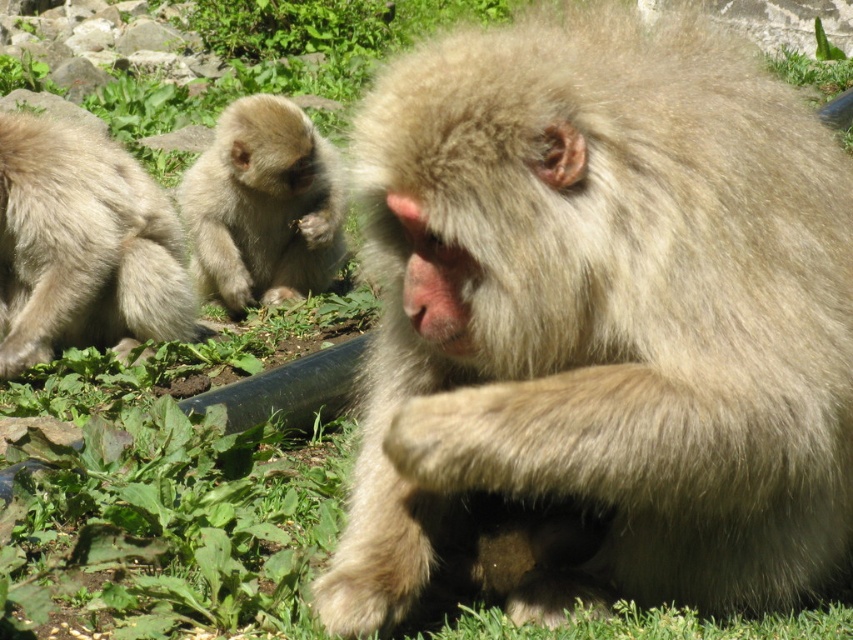
Question: Where is fuzzy beige monkey at center located in relation to fuzzy beige monkey at left in the image?

Choices:
 (A) above
 (B) below

Answer: (B)

Question: Based on their relative distances, which object is farther from the fuzzy beige monkey at center left?

Choices:
 (A) fuzzy beige monkey at center
 (B) fuzzy beige monkey at left

Answer: (A)

Question: Can you confirm if fuzzy beige monkey at center is positioned below fuzzy beige monkey at left?

Choices:
 (A) no
 (B) yes

Answer: (B)

Question: Which point is farther to the camera?

Choices:
 (A) fuzzy beige monkey at left
 (B) fuzzy beige monkey at center left
 (C) fuzzy beige monkey at center

Answer: (B)

Question: Does fuzzy beige monkey at center come behind fuzzy beige monkey at center left?

Choices:
 (A) yes
 (B) no

Answer: (B)

Question: Which of the following is the closest to the observer?

Choices:
 (A) fuzzy beige monkey at center
 (B) fuzzy beige monkey at left

Answer: (A)